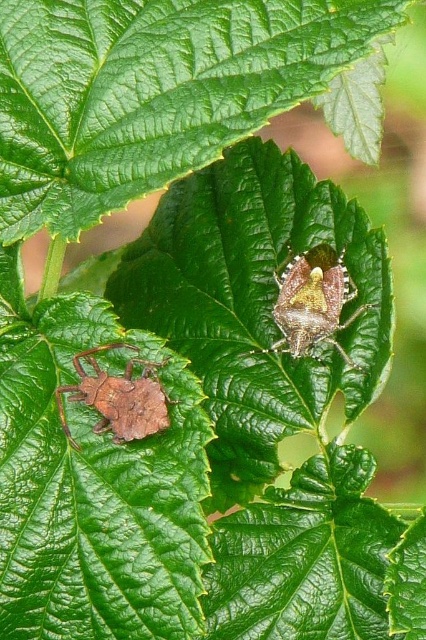
You are an entomologist observing two bugs on a leaf. You need to locate the shiny brown bug at center and the matte brown bug at lower left. Which bug is positioned to the right side of the other?

The shiny brown bug at center is to the right of the matte brown bug at lower left.

You are a gardener trying to identify shield bugs on a leaf. You see a shiny brown bug at center and a matte brown bug at lower left. Which one is bigger?

The shiny brown bug at center is larger in size compared to the matte brown bug at lower left.